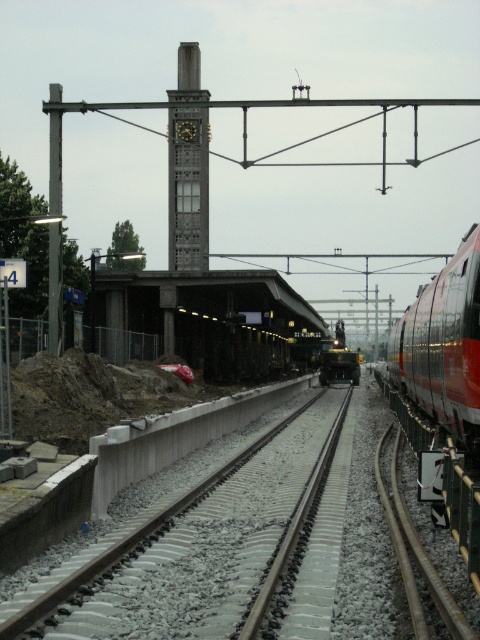
You are a passenger standing on the concrete platform at center and want to board the shiny metallic train at center. Since the platform is wider than the train, where should you position yourself to ensure you can board safely?

Since the concrete platform at center is wider than the shiny metallic train at center, you should position yourself towards the middle of the platform to align with the train doors, ensuring safe boarding.

You are standing on the platform and want to walk from point (243,611) to point (264,296). Which direction should you face to move towards the farther point?

You should face away from the platform towards the tracks because point (243,611) is closer to the viewer than point (264,296), so moving towards the farther point requires going away from the viewer.